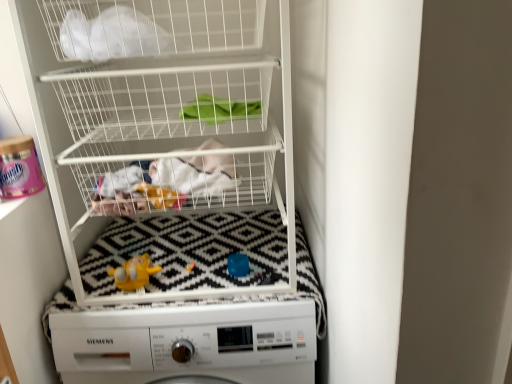
At what (x,y) coordinates should I click in order to perform the action: click on white matte washing machine at center. Please return your answer as a coordinate pair (x, y). The height and width of the screenshot is (384, 512). Looking at the image, I should click on (191, 336).

What do you see at coordinates (134, 273) in the screenshot? The height and width of the screenshot is (384, 512). I see `yellow rubber duck at center` at bounding box center [134, 273].

Where is `white fabric at center`? Image resolution: width=512 pixels, height=384 pixels. white fabric at center is located at coordinates (195, 174).

Describe the element at coordinates (177, 192) in the screenshot. This screenshot has width=512, height=384. I see `white wire basket at upper center` at that location.

Where is `white matte washing machine at center`? Image resolution: width=512 pixels, height=384 pixels. white matte washing machine at center is located at coordinates (191, 336).

Does white wire basket at upper center touch white matte washing machine at center?

white wire basket at upper center is not next to white matte washing machine at center, and they're not touching.

From a real-world perspective, is white wire basket at upper center located higher than white matte washing machine at center?

Indeed, from a real-world perspective, white wire basket at upper center stands above white matte washing machine at center.

Can you confirm if white wire basket at upper center is smaller than white matte washing machine at center?

Correct, white wire basket at upper center occupies less space than white matte washing machine at center.

I want to click on clothing behind the white matte washing machine at center, so click(x=195, y=174).

From the image's perspective, who appears lower, white fabric at center or white matte washing machine at center?

white matte washing machine at center appears lower in the image.

Considering the sizes of objects white fabric at center and white matte washing machine at center in the image provided, who is wider, white fabric at center or white matte washing machine at center?

white matte washing machine at center.

Is white fabric at center with white matte washing machine at center?

No, white fabric at center is not beside white matte washing machine at center.

Find the location of `shelf in front of the yellow rubber duck at center`. shelf in front of the yellow rubber duck at center is located at coordinates (150, 27).

Is yellow rubber duck at center oriented towards white mesh bag at upper left?

No, yellow rubber duck at center is not facing towards white mesh bag at upper left.

Is point (131, 269) closer or farther from the camera than point (254, 27)?

Point (131, 269) appears to be farther away from the viewer than point (254, 27).

Based on the photo, looking at the image, does white wire basket at upper center seem bigger or smaller compared to white fabric at center?

Clearly, white wire basket at upper center is larger in size than white fabric at center.

Would you say white wire basket at upper center is inside or outside white fabric at center?

white wire basket at upper center is spatially situated outside white fabric at center.

Does white wire basket at upper center touch white fabric at center?

No.

Which object is thinner, white wire basket at upper center or white fabric at center?

With smaller width is white fabric at center.

Is white matte washing machine at center touching white fabric at center?

There is a gap between white matte washing machine at center and white fabric at center.

From the picture: Considering the sizes of objects white matte washing machine at center and white fabric at center in the image provided, who is taller, white matte washing machine at center or white fabric at center?

With more height is white matte washing machine at center.

Is point (154, 255) less distant than point (203, 194)?

No.

Is white fabric at center at the back of yellow rubber duck at center?

No, yellow rubber duck at center is not facing away from white fabric at center.

Considering the sizes of objects yellow rubber duck at center and white fabric at center in the image provided, who is bigger, yellow rubber duck at center or white fabric at center?

white fabric at center.

How different are the orientations of yellow rubber duck at center and white fabric at center in degrees?

The facing directions of yellow rubber duck at center and white fabric at center are 0.00295 degrees apart.

Which is closer, (131, 273) or (192, 175)?

Point (131, 273).

From a real-world perspective, is white wire basket at upper center on white mesh bag at upper left?

No, from a real-world perspective, white wire basket at upper center is not over white mesh bag at upper left

Locate an element on the screen. This screenshot has width=512, height=384. bunk bed below the white mesh bag at upper left (from the image's perspective) is located at coordinates (177, 192).

Can you confirm if white wire basket at upper center is shorter than white mesh bag at upper left?

No, white wire basket at upper center is not shorter than white mesh bag at upper left.

Is white wire basket at upper center positioned behind white mesh bag at upper left?

No.

Locate an element on the screen. bunk bed in front of the white matte washing machine at center is located at coordinates (177, 192).

Where is `clothing on the right of white matte washing machine at center`? clothing on the right of white matte washing machine at center is located at coordinates (195, 174).

Looking at the image, which one is located closer to white matte washing machine at center, yellow rubber duck at center or white mesh bag at upper left?

yellow rubber duck at center.

Estimate the real-world distances between objects in this image. Which object is further from yellow rubber duck at center, white matte washing machine at center or white mesh bag at upper left?

The object further to yellow rubber duck at center is white mesh bag at upper left.

Estimate the real-world distances between objects in this image. Which object is closer to white wire basket at upper center, yellow rubber duck at center or white mesh bag at upper left?

Among the two, white mesh bag at upper left is located nearer to white wire basket at upper center.

Based on the photo, considering their positions, is white fabric at center positioned further to white matte washing machine at center than white mesh bag at upper left?

Based on the image, white mesh bag at upper left appears to be further to white matte washing machine at center.

Estimate the real-world distances between objects in this image. Which object is further from white matte washing machine at center, white wire basket at upper center or yellow rubber duck at center?

The object further to white matte washing machine at center is yellow rubber duck at center.

Based on their spatial positions, is white mesh bag at upper left or yellow rubber duck at center closer to white fabric at center?

Among the two, yellow rubber duck at center is located nearer to white fabric at center.

Looking at the image, which one is located further to yellow rubber duck at center, white fabric at center or white matte washing machine at center?

white fabric at center is further to yellow rubber duck at center.

Based on their spatial positions, is white wire basket at upper center or yellow rubber duck at center further from white fabric at center?

Based on the image, yellow rubber duck at center appears to be further to white fabric at center.

Where is `clothing between white wire basket at upper center and yellow rubber duck at center in the up-down direction`? The height and width of the screenshot is (384, 512). clothing between white wire basket at upper center and yellow rubber duck at center in the up-down direction is located at coordinates (195, 174).

I want to click on bunk bed that lies between white mesh bag at upper left and white fabric at center from top to bottom, so pyautogui.click(x=177, y=192).

The height and width of the screenshot is (384, 512). Find the location of `clothing between white mesh bag at upper left and yellow rubber duck at center vertically`. clothing between white mesh bag at upper left and yellow rubber duck at center vertically is located at coordinates (x=195, y=174).

I want to click on toy that lies between white mesh bag at upper left and white matte washing machine at center from top to bottom, so click(134, 273).